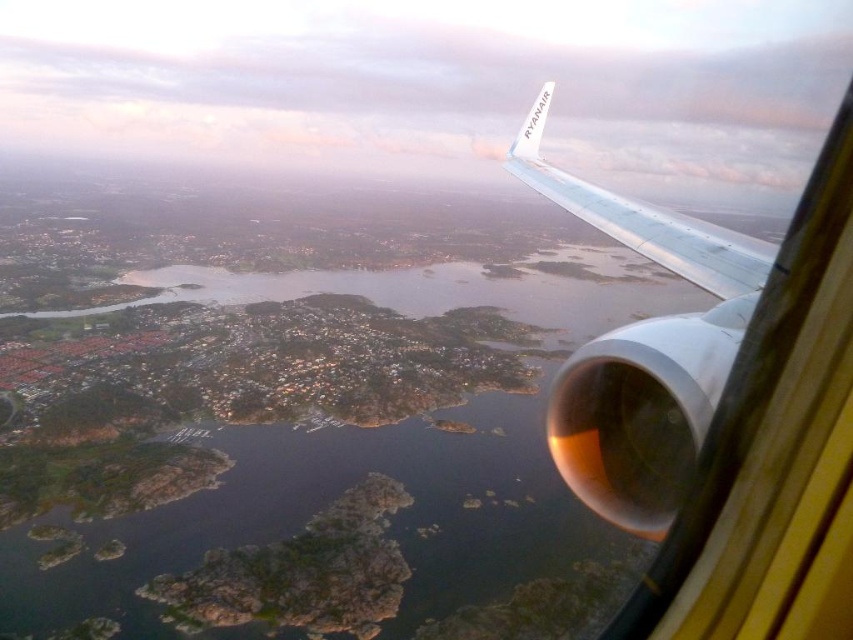
Question: Can you confirm if greenish-blue water at center is smaller than metallic silver wing at upper right?

Choices:
 (A) yes
 (B) no

Answer: (B)

Question: Among these objects, which one is nearest to the camera?

Choices:
 (A) white metallic wing at upper right
 (B) metallic silver wing at upper right
 (C) greenish-blue water at center

Answer: (B)

Question: Which point is closer to the camera?

Choices:
 (A) greenish-blue water at center
 (B) white metallic wing at upper right

Answer: (B)

Question: Based on their relative distances, which object is farther from the greenish-blue water at center?

Choices:
 (A) metallic silver wing at upper right
 (B) white metallic wing at upper right

Answer: (A)

Question: In this image, where is greenish-blue water at center located relative to white metallic wing at upper right?

Choices:
 (A) above
 (B) below

Answer: (B)

Question: Does metallic silver wing at upper right appear under white metallic wing at upper right?

Choices:
 (A) yes
 (B) no

Answer: (A)